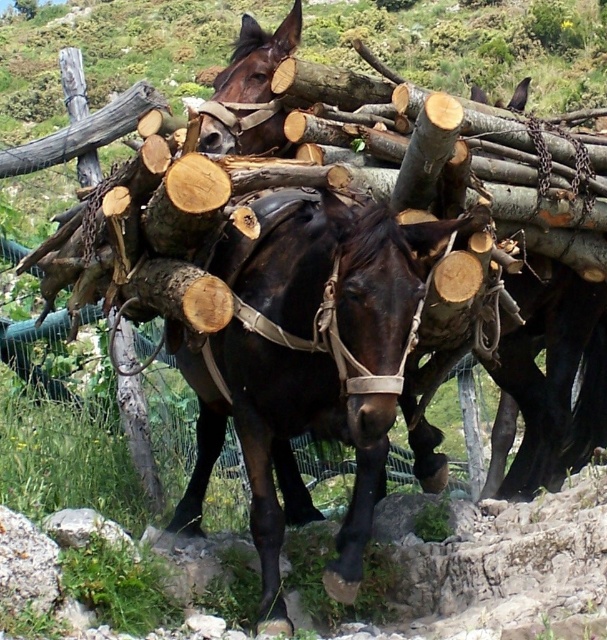
Question: From the image, what is the correct spatial relationship of brown leather harness at center in relation to shiny brown horse at center?

Choices:
 (A) right
 (B) left

Answer: (A)

Question: Can you confirm if brown leather harness at center is positioned above shiny brown horse at center?

Choices:
 (A) yes
 (B) no

Answer: (A)

Question: Is brown leather harness at center further to the viewer compared to shiny brown horse at center?

Choices:
 (A) yes
 (B) no

Answer: (B)